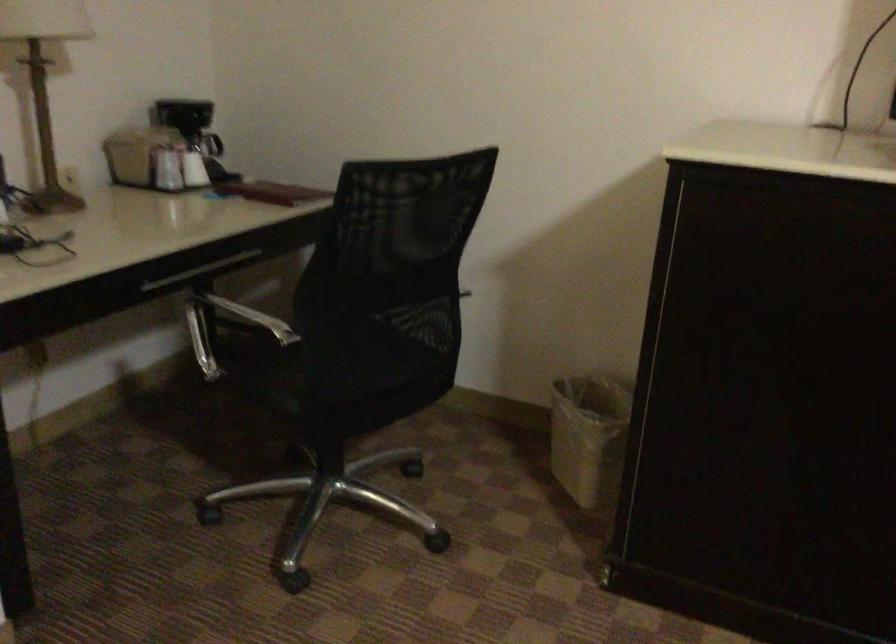
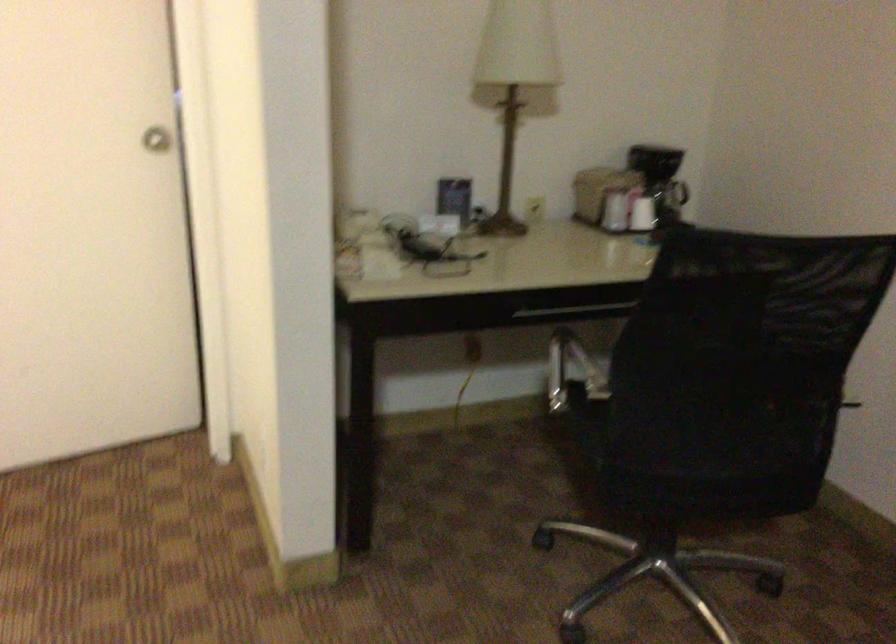
Find the pixel in the second image that matches point (144, 151) in the first image.

(598, 192)